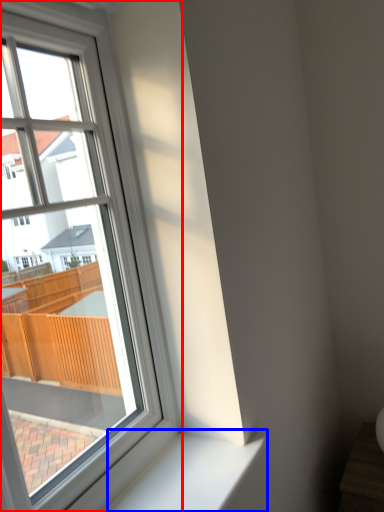
Question: Among these objects, which one is farthest to the camera, window (highlighted by a red box) or window sill (highlighted by a blue box)?

Choices:
 (A) window
 (B) window sill

Answer: (B)